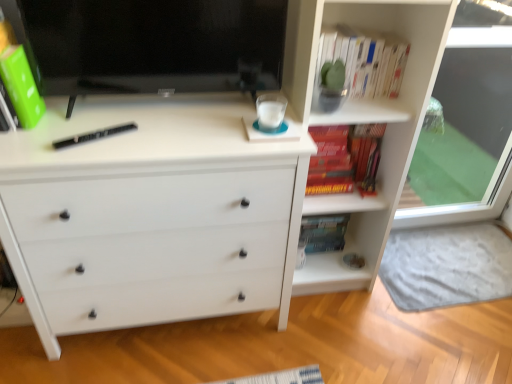
This screenshot has width=512, height=384. I want to click on black hardback book at center, so click(94, 135).

The image size is (512, 384). What are the coordinates of `white matte chest of drawers at center` in the screenshot? It's located at (150, 215).

What do you see at coordinates (324, 232) in the screenshot?
I see `hardcover book at center-right, acting as the second paperback book starting from the left` at bounding box center [324, 232].

You are a GUI agent. You are given a task and a screenshot of the screen. Output one action in this format:
    pyautogui.click(x=<x>, y=<y>)
    Task: Click on the white paper book at upper right, which is the second book from bottom to top
    The width and height of the screenshot is (512, 384).
    Given the screenshot: What is the action you would take?
    pyautogui.click(x=362, y=62)

Locate an element on the screen. The height and width of the screenshot is (384, 512). paperback book behind the white matte chest of drawers at center is located at coordinates [324, 232].

From a real-world perspective, which object stands above the other?

In real-world perspective, white matte chest of drawers at center is above.

Is white matte chest of drawers at center facing away from hardcover book at center-right, marked as the first paperback book in a back-to-front arrangement?

white matte chest of drawers at center is not turned away from hardcover book at center-right, marked as the first paperback book in a back-to-front arrangement.

Is white matte chest of drawers at center to the left or to the right of hardcover book at center-right, which is the 2th paperback book in front-to-back order, in the image?

Based on their positions, white matte chest of drawers at center is located to the left of hardcover book at center-right, which is the 2th paperback book in front-to-back order.

Who is taller, hardcover book at center-right, marked as the second paperback book in a top-to-bottom arrangement, or white paper book at upper right, which is the second book from bottom to top?

Standing taller between the two is hardcover book at center-right, marked as the second paperback book in a top-to-bottom arrangement.

Which of these two, hardcover book at center-right, which appears as the 1th paperback book when ordered from the bottom, or white paper book at upper right, which is the second book from bottom to top, is wider?

white paper book at upper right, which is the second book from bottom to top, is wider.

Is hardcover book at center-right, which is the first paperback book in right-to-left order, not near white paper book at upper right, which is the second book from bottom to top?

No, hardcover book at center-right, which is the first paperback book in right-to-left order, is not far away from white paper book at upper right, which is the second book from bottom to top.

Is point (75, 138) more distant than point (8, 93)?

Yes, it is behind point (8, 93).

Is black hardback book at center inside or outside of green matte book at upper left, marked as the first paperback book in a top-to-bottom arrangement?

black hardback book at center is not inside green matte book at upper left, marked as the first paperback book in a top-to-bottom arrangement, it's outside.

Looking at this image, does black hardback book at center have a lesser height compared to green matte book at upper left, the second paperback book when ordered from back to front?

Yes.

How much distance is there between black hardback book at center and green matte book at upper left, the first paperback book in the front-to-back sequence?

They are 7.57 inches apart.

From a real-world perspective, is green matte book at upper left, the first paperback book in the front-to-back sequence, positioned above or below white paper book at upper right, which is the first book in top-to-bottom order?

Clearly, from a real-world perspective, green matte book at upper left, the first paperback book in the front-to-back sequence, is above white paper book at upper right, which is the first book in top-to-bottom order.

Could you tell me if green matte book at upper left, the second paperback book when ordered from back to front, is facing white paper book at upper right, which is the first book in top-to-bottom order?

Yes, green matte book at upper left, the second paperback book when ordered from back to front, faces towards white paper book at upper right, which is the first book in top-to-bottom order.

Which point is more distant from viewer, (41, 97) or (398, 57)?

Point (398, 57)

Is hardcover book at upper right, acting as the second book starting from the top, in front of or behind black hardback book at center in the image?

hardcover book at upper right, acting as the second book starting from the top, is behind black hardback book at center.

Who is smaller, hardcover book at upper right, acting as the second book starting from the top, or black hardback book at center?

With smaller size is black hardback book at center.

How different are the orientations of hardcover book at upper right, acting as the second book starting from the top, and black hardback book at center in degrees?

hardcover book at upper right, acting as the second book starting from the top, and black hardback book at center are facing 61.4 degrees away from each other.

From the picture: From the image's perspective, relative to black hardback book at center, is hardcover book at upper right, placed as the first book when sorted from bottom to top, above or below?

From the image's perspective, hardcover book at upper right, placed as the first book when sorted from bottom to top, appears above black hardback book at center.

How far apart are hardcover book at center-right, which appears as the 1th paperback book when ordered from the bottom, and green matte book at upper left, the first paperback book in the left-to-right sequence?

hardcover book at center-right, which appears as the 1th paperback book when ordered from the bottom, and green matte book at upper left, the first paperback book in the left-to-right sequence, are 3.78 feet apart.

Is there a large distance between hardcover book at center-right, marked as the first paperback book in a back-to-front arrangement, and green matte book at upper left, positioned as the 2th paperback book in right-to-left order?

Indeed, hardcover book at center-right, marked as the first paperback book in a back-to-front arrangement, is not near green matte book at upper left, positioned as the 2th paperback book in right-to-left order.

Between hardcover book at center-right, acting as the second paperback book starting from the left, and green matte book at upper left, which ranks as the second paperback book in bottom-to-top order, which one is positioned in front?

green matte book at upper left, which ranks as the second paperback book in bottom-to-top order, is more forward.

How many degrees apart are the facing directions of hardcover book at center-right, marked as the second paperback book in a top-to-bottom arrangement, and green matte book at upper left, the first paperback book in the left-to-right sequence?

The angular difference between hardcover book at center-right, marked as the second paperback book in a top-to-bottom arrangement, and green matte book at upper left, the first paperback book in the left-to-right sequence, is 87.3 degrees.

From a real-world perspective, which object stands above the other?

matte black monitor at upper left.

Could you measure the distance between matte black monitor at upper left and white paper book at upper right, which is the first book in top-to-bottom order?

A distance of 41.49 centimeters exists between matte black monitor at upper left and white paper book at upper right, which is the first book in top-to-bottom order.

Is matte black monitor at upper left further to the viewer compared to white paper book at upper right, which is the second book from bottom to top?

No.

The image size is (512, 384). In order to click on paperback book below the white matte chest of drawers at center (from the image's perspective) in this screenshot , I will do [324, 232].

There is a hardcover book at center-right, which is the 2th paperback book in front-to-back order. Where is `the 2nd book above it (from a real-world perspective)`? This screenshot has height=384, width=512. the 2nd book above it (from a real-world perspective) is located at coordinates (362, 62).

Based on their spatial positions, is green matte book at upper left, marked as the first paperback book in a top-to-bottom arrangement, or black hardback book at center closer to hardcover book at upper right, placed as the first book when sorted from bottom to top?

The object closer to hardcover book at upper right, placed as the first book when sorted from bottom to top, is black hardback book at center.

Considering their positions, is hardcover book at upper right, acting as the second book starting from the top, positioned closer to black hardback book at center than transparent glass door at right?

hardcover book at upper right, acting as the second book starting from the top, lies closer to black hardback book at center than the other object.

Which object lies nearer to the anchor point transparent glass door at right, white paper book at upper right, which is the second book from bottom to top, or matte black monitor at upper left?

white paper book at upper right, which is the second book from bottom to top, lies closer to transparent glass door at right than the other object.

Based on their spatial positions, is white paper book at upper right, which is the first book in top-to-bottom order, or hardcover book at upper right, acting as the second book starting from the top, further from matte black monitor at upper left?

Among the two, hardcover book at upper right, acting as the second book starting from the top, is located further to matte black monitor at upper left.

Looking at the image, which one is located closer to hardcover book at center-right, which is the first paperback book in right-to-left order, transparent glass door at right or black hardback book at center?

Based on the image, transparent glass door at right appears to be nearer to hardcover book at center-right, which is the first paperback book in right-to-left order.

Looking at the image, which one is located closer to transparent glass door at right, black hardback book at center or green matte book at upper left, the first paperback book in the left-to-right sequence?

Among the two, black hardback book at center is located nearer to transparent glass door at right.

When comparing their distances from black hardback book at center, does white matte chest of drawers at center or green matte book at upper left, the second paperback book when ordered from back to front, seem further?

white matte chest of drawers at center.

Consider the image. When comparing their distances from transparent glass door at right, does matte black monitor at upper left or white matte chest of drawers at center seem further?

matte black monitor at upper left lies further to transparent glass door at right than the other object.

I want to click on the chest of drawers situated between black hardback book at center and transparent glass door at right from left to right, so 150,215.

I want to click on chest of drawers between green matte book at upper left, the second paperback book when ordered from back to front, and hardcover book at center-right, marked as the first paperback book in a back-to-front arrangement, so click(x=150, y=215).

This screenshot has width=512, height=384. I want to click on paperback book between black hardback book at center and transparent glass door at right from left to right, so click(324, 232).

Identify the location of book between green matte book at upper left, the first paperback book in the left-to-right sequence, and hardcover book at upper right, acting as the second book starting from the top. Image resolution: width=512 pixels, height=384 pixels. (362, 62).